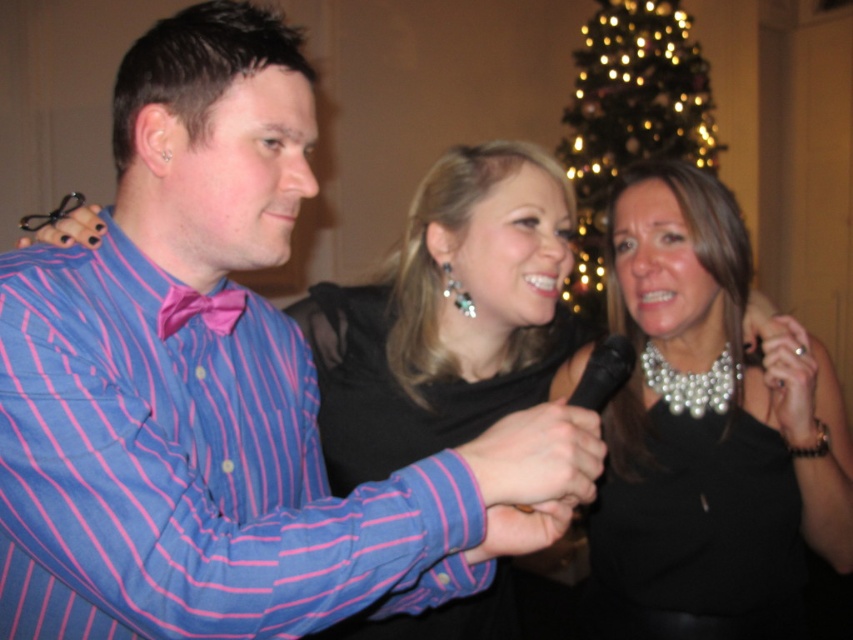
Question: Among these objects, which one is farthest from the camera?

Choices:
 (A) iridescent glass christmas tree at upper center
 (B) black satin dress at right

Answer: (A)

Question: Does pink striped shirt at left appear on the right side of pearl necklace at center?

Choices:
 (A) no
 (B) yes

Answer: (A)

Question: Is pearl necklace at center wider than iridescent glass christmas tree at upper center?

Choices:
 (A) yes
 (B) no

Answer: (B)

Question: Based on their relative distances, which object is nearer to the black satin dress at right?

Choices:
 (A) black satin dress at center
 (B) pink striped shirt at left

Answer: (A)

Question: Is black satin dress at center to the left of black satin dress at right from the viewer's perspective?

Choices:
 (A) yes
 (B) no

Answer: (A)

Question: Based on their relative distances, which object is farther from the black satin dress at center?

Choices:
 (A) pearl necklace at center
 (B) pink satin bow tie at center
 (C) pink striped shirt at left

Answer: (B)